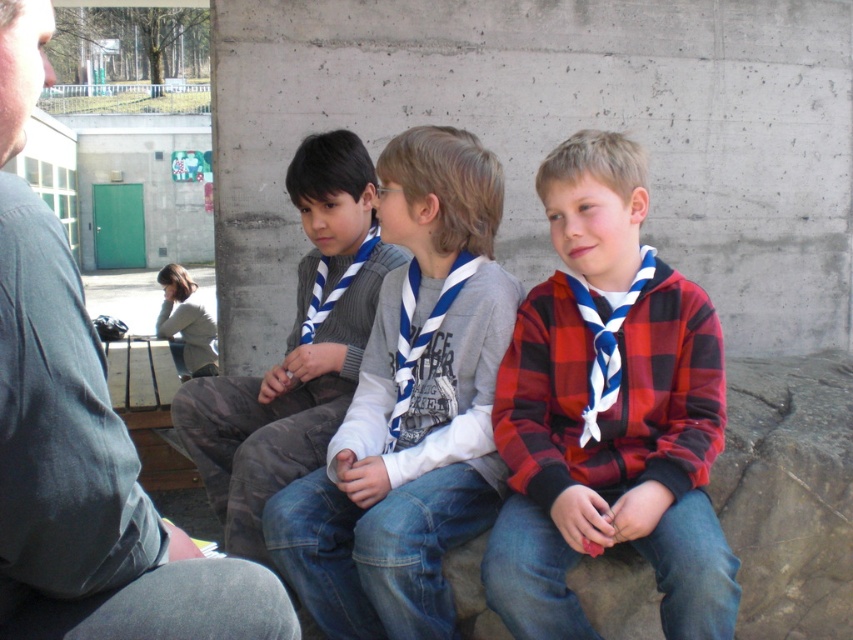
Does red plaid shirt at center come in front of gray sweater vest at center?

That is True.

Where is `red plaid shirt at center`? red plaid shirt at center is located at coordinates (608, 412).

Is blue and white striped scarf at center bigger than gray cotton shirt at left?

Yes.

From the picture: Can you confirm if blue and white striped scarf at center is wider than gray cotton shirt at left?

Correct, the width of blue and white striped scarf at center exceeds that of gray cotton shirt at left.

Which is behind, point (430, 528) or point (3, 259)?

Point (430, 528)

This screenshot has width=853, height=640. I want to click on blue and white striped scarf at center, so coord(410,408).

Does red plaid shirt at center have a smaller size compared to blue and white striped scarf at center?

Yes.

Who is shorter, red plaid shirt at center or blue and white striped scarf at center?

With less height is red plaid shirt at center.

Who is more forward, (723, 618) or (398, 342)?

Point (723, 618)

Where is `red plaid shirt at center`? red plaid shirt at center is located at coordinates (608, 412).